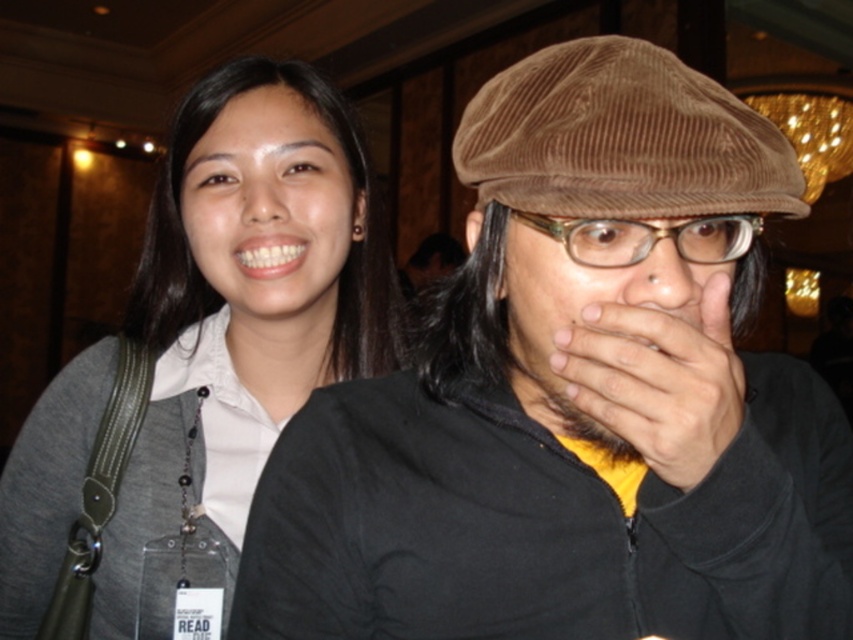
Does brown corduroy cap at upper right appear on the left side of dark skin/hair at center?

Yes, brown corduroy cap at upper right is to the left of dark skin/hair at center.

Which is in front, point (511, 204) or point (689, 440)?

Point (689, 440)

Where is `brown corduroy cap at upper right`? Image resolution: width=853 pixels, height=640 pixels. brown corduroy cap at upper right is located at coordinates (619, 138).

This screenshot has height=640, width=853. Find the location of `brown corduroy cap at upper right`. brown corduroy cap at upper right is located at coordinates (619, 138).

Does brown corduroy cap at upper center appear under brown corduroy cap at upper right?

Indeed, brown corduroy cap at upper center is positioned under brown corduroy cap at upper right.

Where is `brown corduroy cap at upper center`? This screenshot has width=853, height=640. brown corduroy cap at upper center is located at coordinates (573, 403).

Image resolution: width=853 pixels, height=640 pixels. I want to click on brown corduroy cap at upper center, so click(573, 403).

Who is taller, gray fabric shirt at left or brown corduroy cap at upper right?

Standing taller between the two is gray fabric shirt at left.

Does gray fabric shirt at left lie behind brown corduroy cap at upper right?

Yes, it is.

Does point (158, 476) lie in front of point (747, 177)?

No, it is behind (747, 177).

The image size is (853, 640). In order to click on gray fabric shirt at left in this screenshot , I will do `click(202, 364)`.